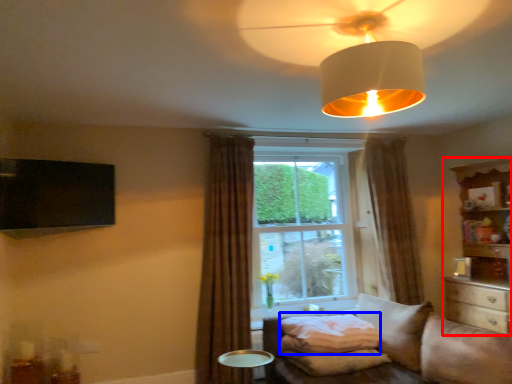
Question: Which object is further to the camera taking this photo, entertainment center (highlighted by a red box) or pillow (highlighted by a blue box)?

Choices:
 (A) entertainment center
 (B) pillow

Answer: (A)